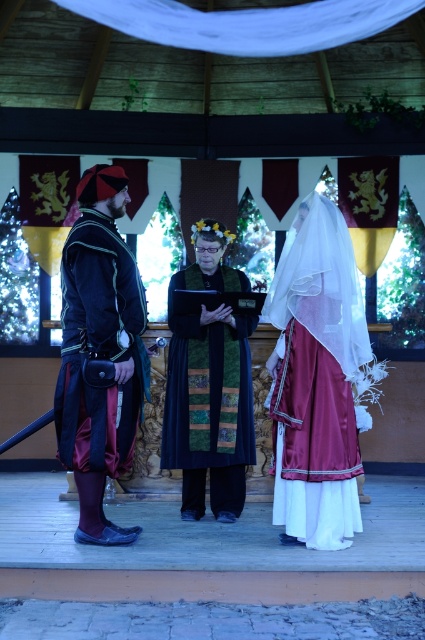
Question: Based on their relative distances, which object is farther from the satin/velvet dress at center?

Choices:
 (A) velvet green robe at center
 (B) velvet dark blue tunic at left

Answer: (B)

Question: Does velvet dark blue dress at center appear on the left side of velvet dark blue tunic at left?

Choices:
 (A) no
 (B) yes

Answer: (A)

Question: Which point is farther from the camera taking this photo?

Choices:
 (A) click(285, 467)
 (B) click(220, 276)

Answer: (B)

Question: Is velvet dark blue dress at center wider than velvet dark blue tunic at left?

Choices:
 (A) no
 (B) yes

Answer: (B)

Question: Which is farther from the velvet dark blue dress at center?

Choices:
 (A) satin/velvet dress at center
 (B) velvet dark blue tunic at left

Answer: (B)

Question: Is satin/velvet dress at center positioned at the back of velvet green robe at center?

Choices:
 (A) no
 (B) yes

Answer: (A)